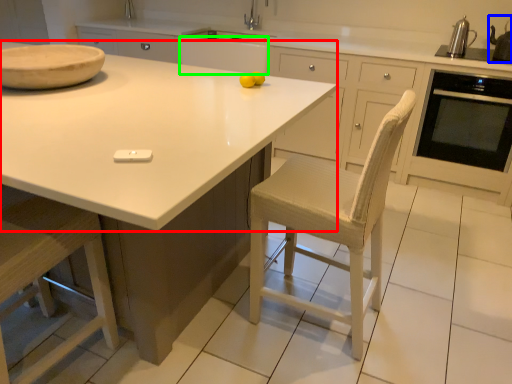
Question: Considering the real-world distances, which object is closest to countertop (highlighted by a red box)? appliance (highlighted by a blue box) or cabinetry (highlighted by a green box).

Choices:
 (A) appliance
 (B) cabinetry

Answer: (B)